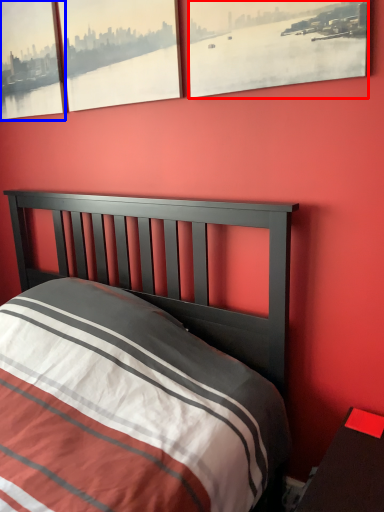
Question: Which of the following is the closest to the observer, window (highlighted by a red box) or window (highlighted by a blue box)?

Choices:
 (A) window
 (B) window

Answer: (A)